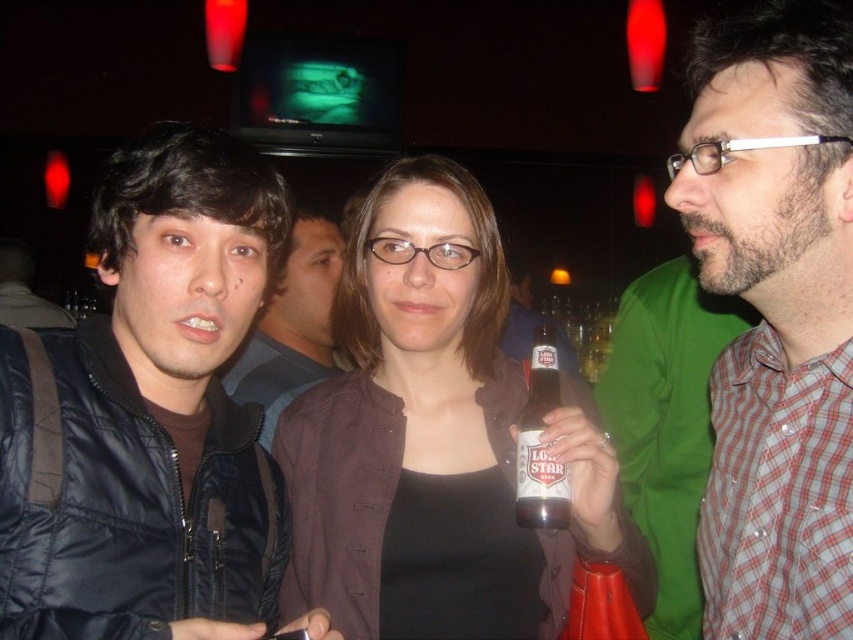
Does black matte jacket at left appear on the right side of brown glass beer bottle at center?

No, black matte jacket at left is not to the right of brown glass beer bottle at center.

Does black matte jacket at left have a greater height compared to brown glass beer bottle at center?

Yes.

Is point (132, 564) more distant than point (561, 524)?

No, it is not.

Locate an element on the screen. black matte jacket at left is located at coordinates (148, 413).

Does black matte jacket at left have a lesser height compared to matte black jacket at center?

No.

Can you confirm if black matte jacket at left is positioned to the right of matte black jacket at center?

Indeed, black matte jacket at left is positioned on the right side of matte black jacket at center.

Image resolution: width=853 pixels, height=640 pixels. What do you see at coordinates (148, 413) in the screenshot? I see `black matte jacket at left` at bounding box center [148, 413].

Locate an element on the screen. The height and width of the screenshot is (640, 853). black matte jacket at left is located at coordinates (148, 413).

Is black matte jacket at left bigger than brown matte jacket at center?

Incorrect, black matte jacket at left is not larger than brown matte jacket at center.

Consider the image. Is black matte jacket at left below brown matte jacket at center?

No.

Is point (99, 628) positioned after point (585, 531)?

No, (99, 628) is closer to viewer.

This screenshot has height=640, width=853. Identify the location of black matte jacket at left. (148, 413).